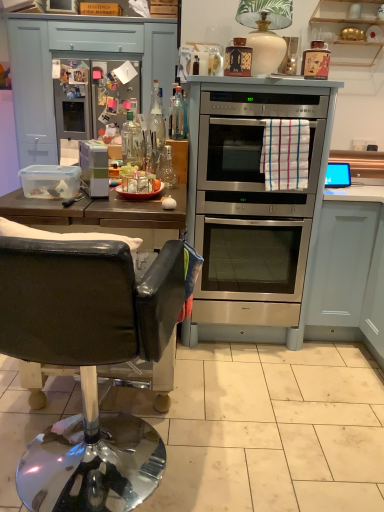
Question: Can you confirm if black leather chair at left is positioned to the left of satin silver fridge at upper left?

Choices:
 (A) no
 (B) yes

Answer: (A)

Question: From a real-world perspective, is black leather chair at left on satin silver fridge at upper left?

Choices:
 (A) no
 (B) yes

Answer: (A)

Question: Does black leather chair at left have a larger size compared to satin silver fridge at upper left?

Choices:
 (A) yes
 (B) no

Answer: (A)

Question: Would you say black leather chair at left is outside satin silver fridge at upper left?

Choices:
 (A) yes
 (B) no

Answer: (A)

Question: Is black leather chair at left shorter than satin silver fridge at upper left?

Choices:
 (A) no
 (B) yes

Answer: (B)

Question: From a real-world perspective, is black leather chair at left positioned under satin silver fridge at upper left based on gravity?

Choices:
 (A) no
 (B) yes

Answer: (B)

Question: Does white matte cabinet at lower right, marked as the 2th cabinetry in a top-to-bottom arrangement, have a lesser width compared to stainless steel oven at center?

Choices:
 (A) yes
 (B) no

Answer: (A)

Question: Considering the relative sizes of white matte cabinet at lower right, which is counted as the first cabinetry, starting from the bottom, and stainless steel oven at center in the image provided, is white matte cabinet at lower right, which is counted as the first cabinetry, starting from the bottom, taller than stainless steel oven at center?

Choices:
 (A) yes
 (B) no

Answer: (A)

Question: Would you say stainless steel oven at center is part of white matte cabinet at lower right, marked as the 2th cabinetry in a top-to-bottom arrangement,'s contents?

Choices:
 (A) yes
 (B) no

Answer: (B)

Question: Is white matte cabinet at lower right, marked as the 2th cabinetry in a top-to-bottom arrangement, behind stainless steel oven at center?

Choices:
 (A) yes
 (B) no

Answer: (A)

Question: From the image's perspective, is white matte cabinet at lower right, marked as the 2th cabinetry in a top-to-bottom arrangement, located above stainless steel oven at center?

Choices:
 (A) no
 (B) yes

Answer: (A)

Question: Does white matte cabinet at lower right, marked as the 2th cabinetry in a top-to-bottom arrangement, appear on the left side of stainless steel oven at center?

Choices:
 (A) no
 (B) yes

Answer: (A)

Question: Is matte blue drawer at upper left wider than wooden shelves at upper right, which is counted as the 2th cabinetry, starting from the bottom?

Choices:
 (A) yes
 (B) no

Answer: (A)